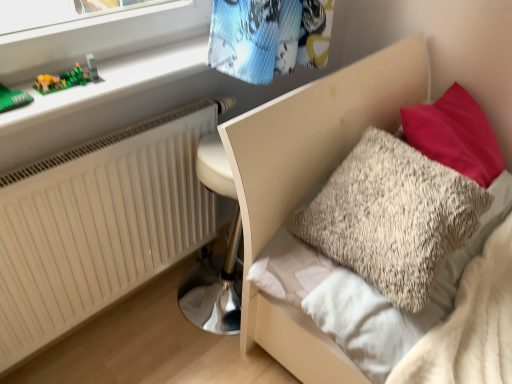
Question: Considering the relative sizes of green plastic toy at upper left and white matte radiator at lower left in the image provided, is green plastic toy at upper left smaller than white matte radiator at lower left?

Choices:
 (A) yes
 (B) no

Answer: (A)

Question: Considering the relative positions of green plastic toy at upper left and white matte radiator at lower left in the image provided, is green plastic toy at upper left to the right of white matte radiator at lower left from the viewer's perspective?

Choices:
 (A) yes
 (B) no

Answer: (B)

Question: Is the position of green plastic toy at upper left more distant than that of white matte radiator at lower left?

Choices:
 (A) no
 (B) yes

Answer: (B)

Question: Does green plastic toy at upper left turn towards white matte radiator at lower left?

Choices:
 (A) yes
 (B) no

Answer: (B)

Question: Is green plastic toy at upper left oriented away from white matte radiator at lower left?

Choices:
 (A) yes
 (B) no

Answer: (B)

Question: In terms of width, does fluffy beige pillow at upper right look wider or thinner when compared to fluffy beige pillow at upper right?

Choices:
 (A) wide
 (B) thin

Answer: (B)

Question: In the image, is fluffy beige pillow at upper right positioned in front of or behind fluffy beige pillow at upper right?

Choices:
 (A) front
 (B) behind

Answer: (B)

Question: Is fluffy beige pillow at upper right situated inside fluffy beige pillow at upper right or outside?

Choices:
 (A) outside
 (B) inside

Answer: (B)

Question: Would you say fluffy beige pillow at upper right is to the left or to the right of fluffy beige pillow at upper right in the picture?

Choices:
 (A) right
 (B) left

Answer: (B)

Question: Considering the positions of green plastic blocks at upper left and fluffy beige pillow at upper right in the image, is green plastic blocks at upper left taller or shorter than fluffy beige pillow at upper right?

Choices:
 (A) tall
 (B) short

Answer: (B)

Question: From the image's perspective, is green plastic blocks at upper left located above or below fluffy beige pillow at upper right?

Choices:
 (A) below
 (B) above

Answer: (B)

Question: Looking at their shapes, would you say green plastic blocks at upper left is wider or thinner than fluffy beige pillow at upper right?

Choices:
 (A) wide
 (B) thin

Answer: (B)

Question: Visually, is green plastic blocks at upper left positioned to the left or to the right of fluffy beige pillow at upper right?

Choices:
 (A) left
 (B) right

Answer: (A)

Question: Considering the positions of green plastic toy at upper left and white matte radiator at lower left in the image, is green plastic toy at upper left wider or thinner than white matte radiator at lower left?

Choices:
 (A) thin
 (B) wide

Answer: (B)

Question: From a real-world perspective, is green plastic toy at upper left positioned above or below white matte radiator at lower left?

Choices:
 (A) above
 (B) below

Answer: (A)